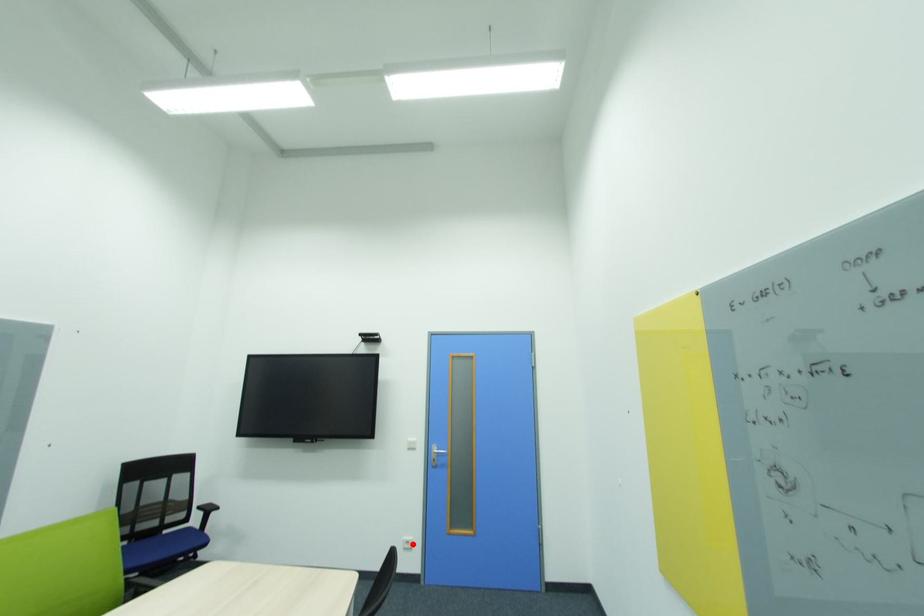
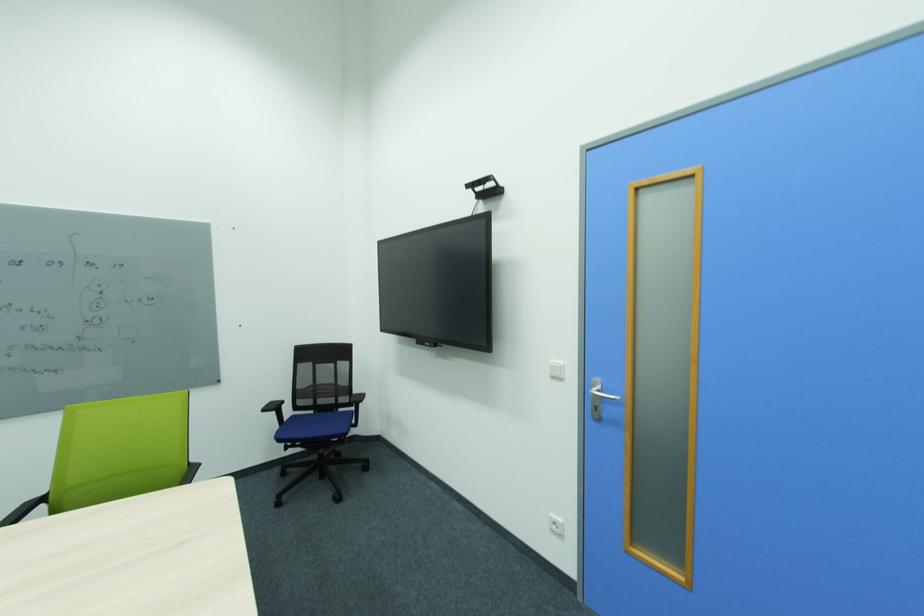
Find the pixel in the second image that matches the highlighted location in the first image.

(560, 525)